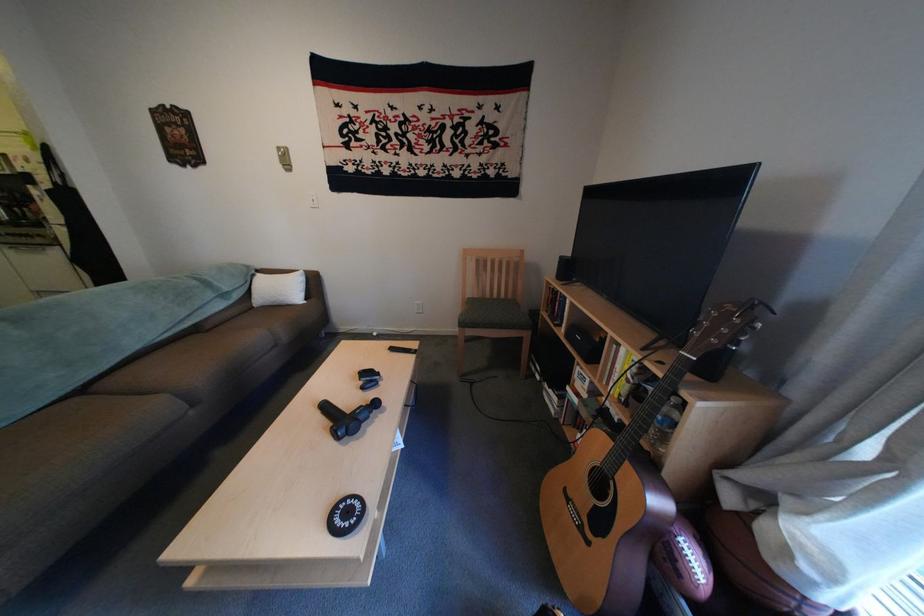
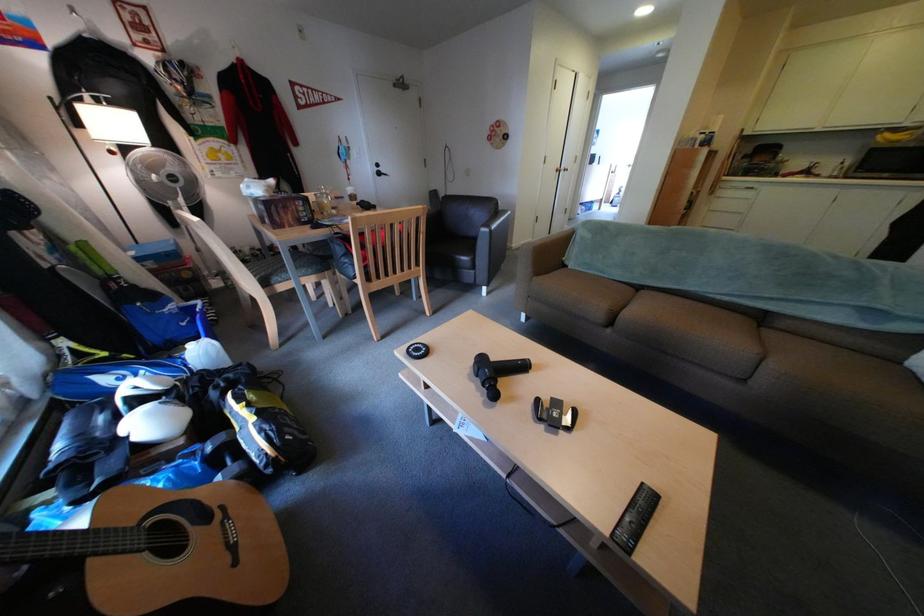
Locate, in the second image, the point that corresponds to (x=391, y=418) in the first image.

(496, 397)